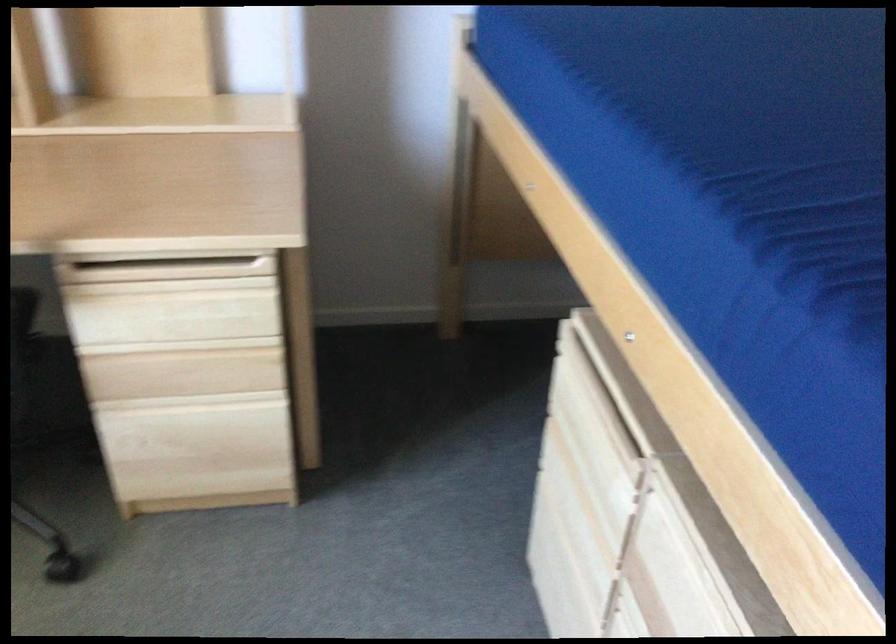
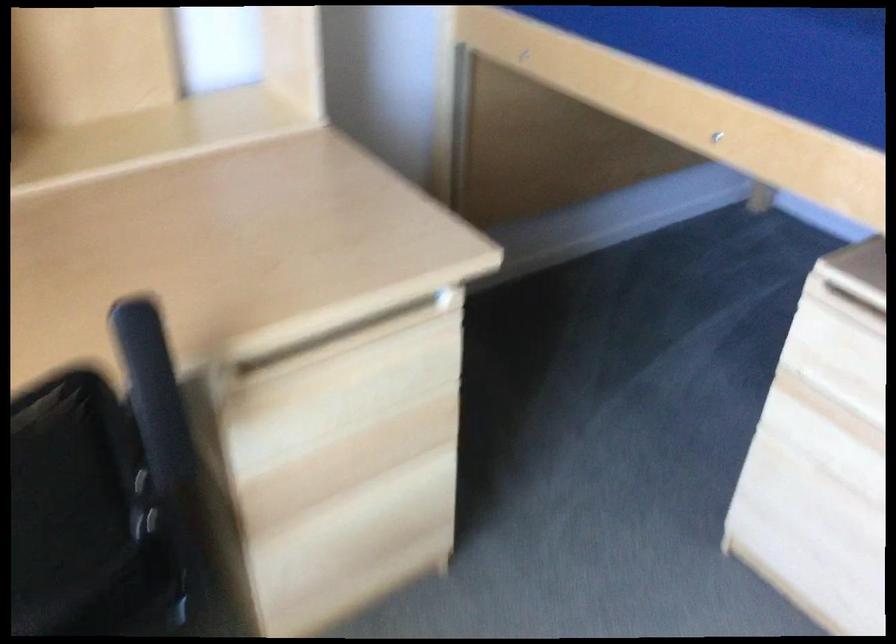
Based on the photo, in a continuous first-person perspective shot, in which direction is the camera moving?

The cameraman walked toward left, forward.